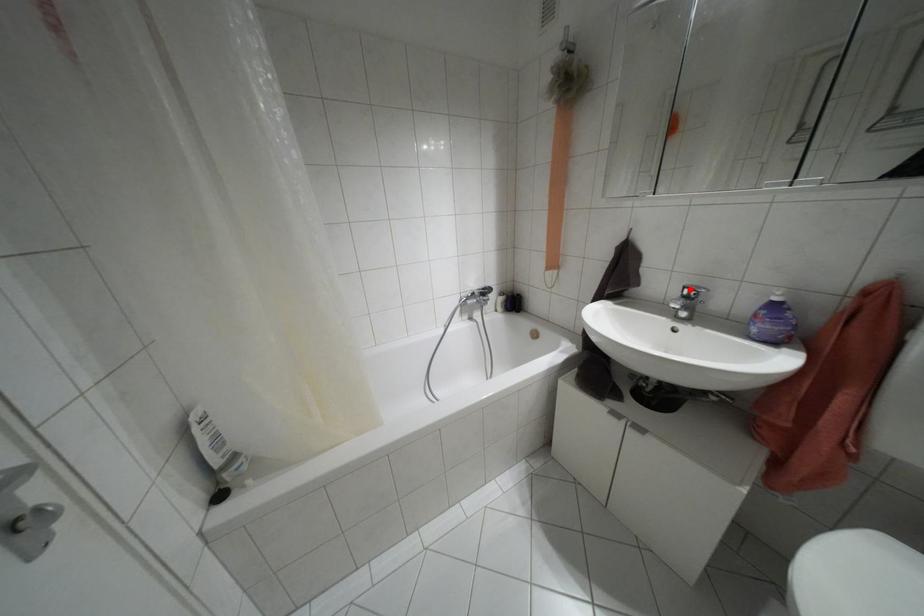
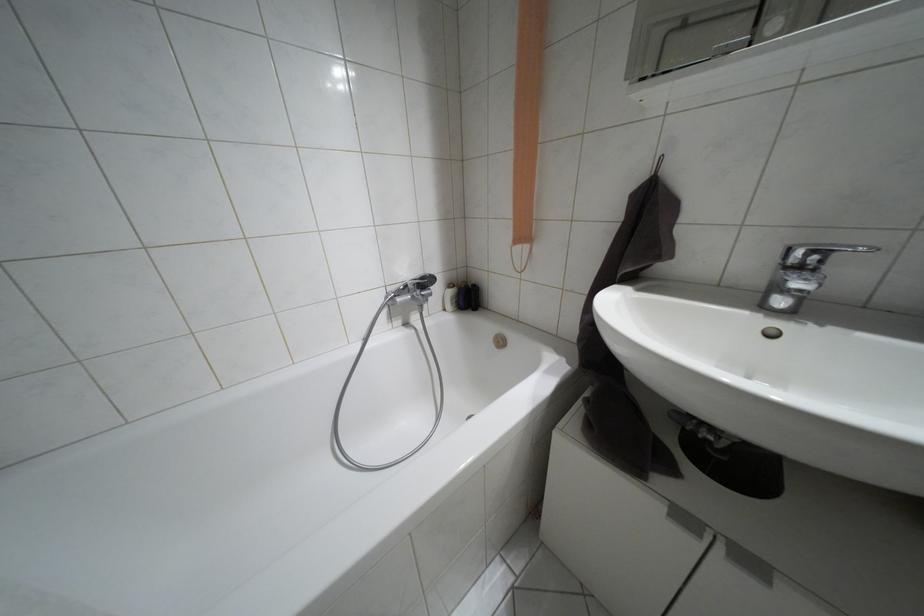
The point at the highlighted location is marked in the first image. Where is the corresponding point in the second image?

(810, 253)